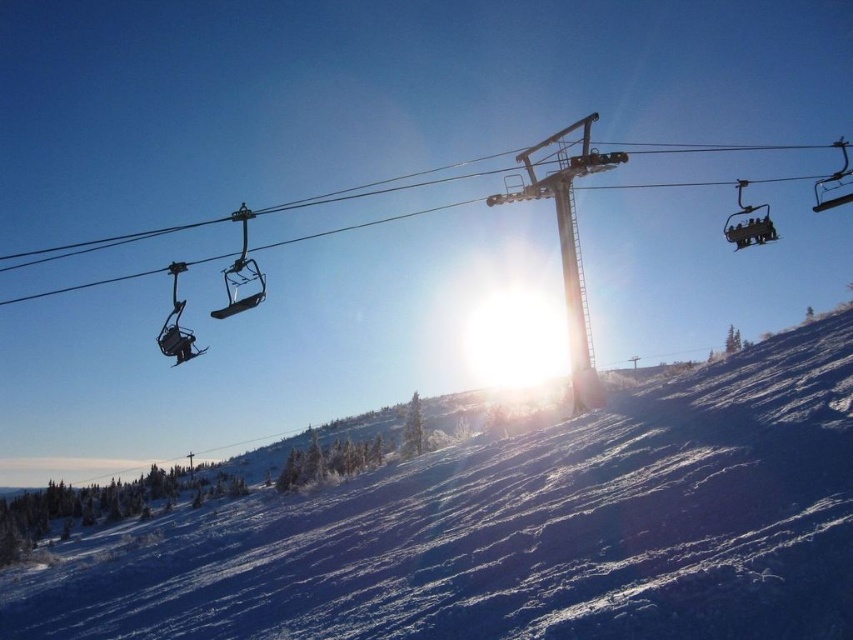
You are planning to build a snowman in the winter scene at the ski resort. The white powdery snow at center is the only suitable snow available. Where exactly should you go to find the snow for your snowman?

The white powdery snow at center is located at point (x=523, y=531), so you should go to that coordinate to find the snow for your snowman.